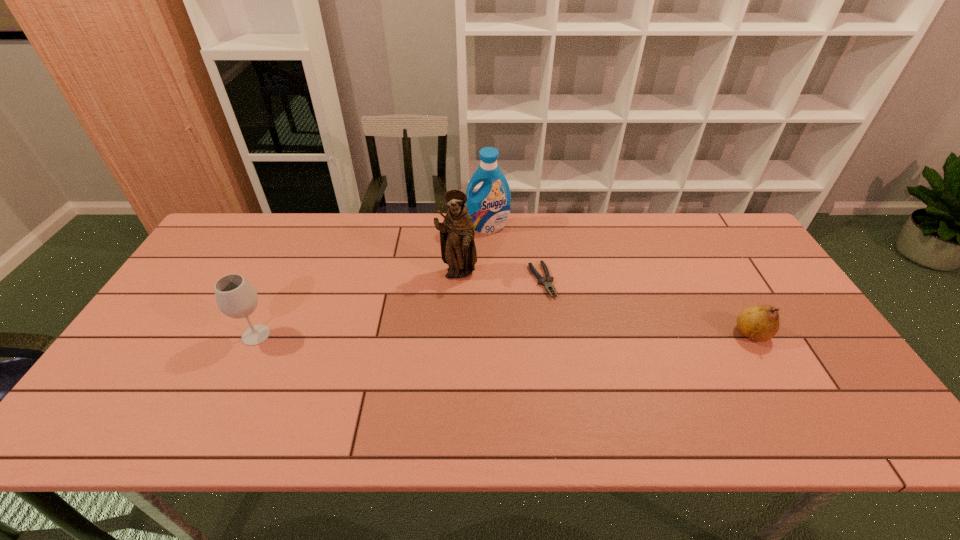
Locate an element on the screen. The width and height of the screenshot is (960, 540). the third tallest object is located at coordinates (235, 296).

What are the coordinates of `the leftmost object` in the screenshot? It's located at (235, 296).

This screenshot has height=540, width=960. What are the coordinates of `the second shortest object` in the screenshot? It's located at (760, 323).

Find the location of `pear`. pear is located at coordinates (760, 323).

Image resolution: width=960 pixels, height=540 pixels. I want to click on the farthest object, so click(489, 207).

The image size is (960, 540). In order to click on figurine in this screenshot , I will do `click(458, 250)`.

The image size is (960, 540). I want to click on the shortest object, so click(546, 283).

Locate an element on the screen. Image resolution: width=960 pixels, height=540 pixels. pliers is located at coordinates (546, 283).

Where is `free location located 0.280m on the back of the wineglass`? This screenshot has width=960, height=540. free location located 0.280m on the back of the wineglass is located at coordinates (294, 255).

The image size is (960, 540). Identify the location of vacant space positioned on the front of the rightmost object. point(787,395).